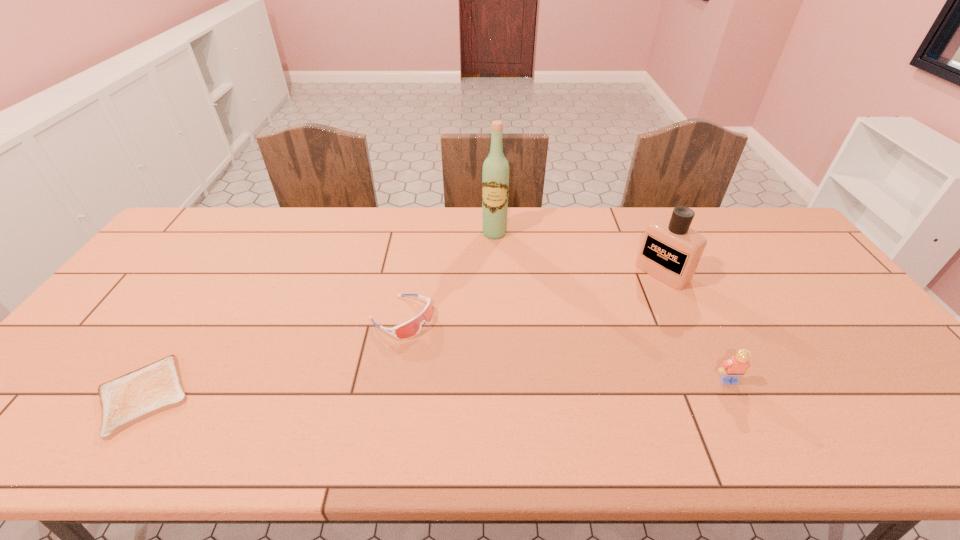
The height and width of the screenshot is (540, 960). I want to click on toast at the near edge, so click(x=135, y=396).

You are a GUI agent. You are given a task and a screenshot of the screen. Output one action in this format:
    pyautogui.click(x=<x>, y=<y>)
    Task: Click on the Lego situated at the near edge
    Image resolution: width=960 pixels, height=540 pixels.
    Given the screenshot: What is the action you would take?
    pyautogui.click(x=732, y=369)

At what (x,y) coordinates should I click in order to perform the action: click on object positioned at the left edge. Please return your answer as a coordinate pair (x, y). This screenshot has width=960, height=540. Looking at the image, I should click on (135, 396).

The width and height of the screenshot is (960, 540). In order to click on object positioned at the near left corner in this screenshot , I will do `click(135, 396)`.

This screenshot has width=960, height=540. What are the coordinates of `vacant region at the far edge of the desktop` in the screenshot? It's located at (491, 245).

Locate an element on the screen. The width and height of the screenshot is (960, 540). vacant space at the near edge of the desktop is located at coordinates (320, 407).

The width and height of the screenshot is (960, 540). What are the coordinates of `free region at the left edge of the desktop` in the screenshot? It's located at (195, 259).

This screenshot has width=960, height=540. In the image, there is a desktop. Find the location of `vacant space at the right edge`. vacant space at the right edge is located at coordinates (795, 254).

In the image, there is a desktop. Where is `vacant area at the far left corner`? The width and height of the screenshot is (960, 540). vacant area at the far left corner is located at coordinates (213, 222).

This screenshot has height=540, width=960. Identify the location of empty space that is in between the second farthest object and the second object from left to right. (532, 295).